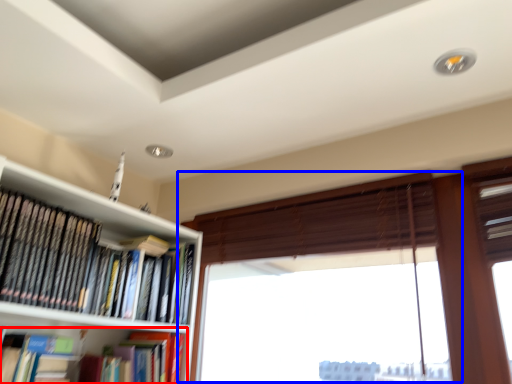
Question: Which point is closer to the camera, book (highlighted by a red box) or window (highlighted by a blue box)?

Choices:
 (A) book
 (B) window

Answer: (B)